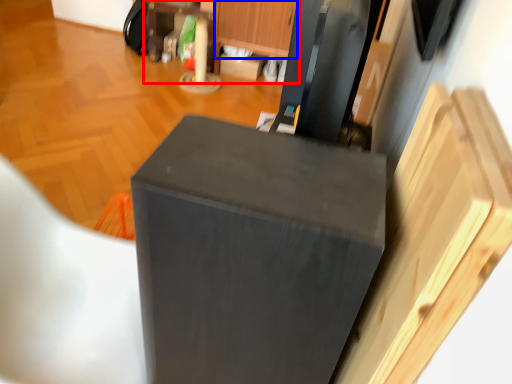
Question: Which object appears farthest to the camera in this image, dresser (highlighted by a red box) or drawer (highlighted by a blue box)?

Choices:
 (A) dresser
 (B) drawer

Answer: (A)